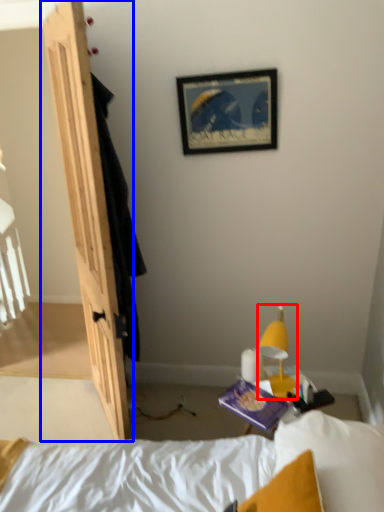
Question: Which object appears closest to the camera in this image, light fixture (highlighted by a red box) or door (highlighted by a blue box)?

Choices:
 (A) light fixture
 (B) door

Answer: (A)